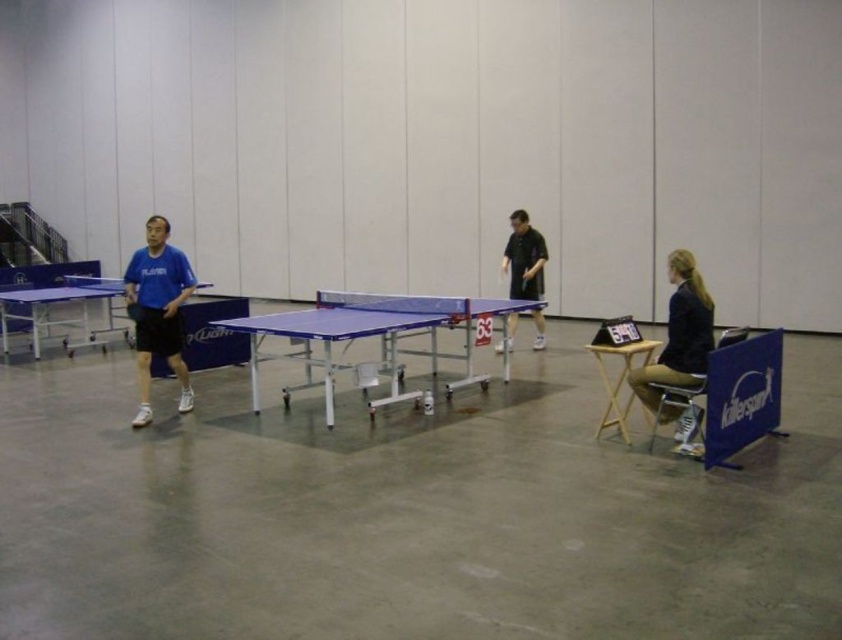
You are a visitor at the table tennis venue and need to place your belongings on the light wood folding table at lower right. However, there is a black fabric jacket at right nearby. Based on their positions, can you tell if the jacket is blocking access to the table?

The black fabric jacket at right is to the right of the light wood folding table at lower right, so it is not blocking access to the table.

From the picture: You are setting up a small event in the gymnasium and need to place a new table near the black fabric jacket at right and the light wood folding table at lower right. Considering their sizes, which object should you place closer to the wall to save space?

The black fabric jacket at right is smaller than the light wood folding table at lower right, so placing the light wood folding table at lower right closer to the wall would save more space since it is larger and requires more room.